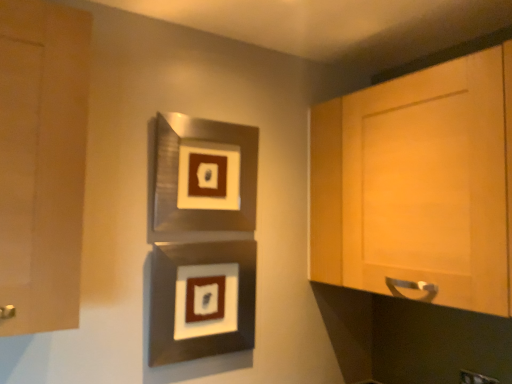
How much space does metallic silver picture frame at center, positioned as the 2th picture frame in top-to-bottom order, occupy vertically?

The height of metallic silver picture frame at center, positioned as the 2th picture frame in top-to-bottom order, is 14.76 inches.

Locate an element on the screen. The height and width of the screenshot is (384, 512). matte wood cabinet at left, the second cabinetry positioned from the right is located at coordinates (42, 162).

You are a GUI agent. You are given a task and a screenshot of the screen. Output one action in this format:
    pyautogui.click(x=<x>, y=<y>)
    Task: Click on the metallic silver picture frame at center, which ranks as the second picture frame in bottom-to-top order
    Image resolution: width=512 pixels, height=384 pixels.
    Given the screenshot: What is the action you would take?
    pyautogui.click(x=204, y=175)

The image size is (512, 384). I want to click on metallic silver picture frame at center, the first picture frame positioned from the bottom, so click(x=202, y=300).

Measure the distance between matte wood cabinet at left, the second cabinetry positioned from the right, and light wood cabinet at right, the 1th cabinetry in the right-to-left sequence.

matte wood cabinet at left, the second cabinetry positioned from the right, and light wood cabinet at right, the 1th cabinetry in the right-to-left sequence, are 39.02 inches apart.

Are matte wood cabinet at left, the second cabinetry positioned from the right, and light wood cabinet at right, which ranks as the second cabinetry in left-to-right order, far apart?

matte wood cabinet at left, the second cabinetry positioned from the right, is actually quite close to light wood cabinet at right, which ranks as the second cabinetry in left-to-right order.

Which of these two, matte wood cabinet at left, the second cabinetry positioned from the right, or light wood cabinet at right, which ranks as the second cabinetry in left-to-right order, is wider?

light wood cabinet at right, which ranks as the second cabinetry in left-to-right order.

Locate an element on the screen. cabinetry that is on the left side of light wood cabinet at right, the 1th cabinetry in the right-to-left sequence is located at coordinates (42, 162).

Measure the distance from matte wood cabinet at left, which is the 1th cabinetry from left to right, to metallic silver picture frame at center, the first picture frame positioned from the bottom.

matte wood cabinet at left, which is the 1th cabinetry from left to right, is 23.36 inches away from metallic silver picture frame at center, the first picture frame positioned from the bottom.

Which object is wider, matte wood cabinet at left, the second cabinetry positioned from the right, or metallic silver picture frame at center, positioned as the 2th picture frame in top-to-bottom order?

With larger width is matte wood cabinet at left, the second cabinetry positioned from the right.

Does matte wood cabinet at left, the second cabinetry positioned from the right, contain metallic silver picture frame at center, positioned as the 2th picture frame in top-to-bottom order?

No, metallic silver picture frame at center, positioned as the 2th picture frame in top-to-bottom order, is located outside of matte wood cabinet at left, the second cabinetry positioned from the right.

Could you tell me if matte wood cabinet at left, the second cabinetry positioned from the right, is facing metallic silver picture frame at center, the first picture frame positioned from the bottom?

No.

From a real-world perspective, between metallic silver picture frame at center, which ranks as the second picture frame in bottom-to-top order, and light wood cabinet at right, which ranks as the second cabinetry in left-to-right order, who is vertically lower?

light wood cabinet at right, which ranks as the second cabinetry in left-to-right order, is physically lower.

Locate an element on the screen. This screenshot has height=384, width=512. cabinetry on the right of the metallic silver picture frame at center, which ranks as the second picture frame in bottom-to-top order is located at coordinates (417, 184).

Is metallic silver picture frame at center, which ranks as the first picture frame in top-to-bottom order, shorter than light wood cabinet at right, which ranks as the second cabinetry in left-to-right order?

Yes.

Based on the photo, considering the relative positions of metallic silver picture frame at center, which ranks as the first picture frame in top-to-bottom order, and light wood cabinet at right, the 1th cabinetry in the right-to-left sequence, in the image provided, is metallic silver picture frame at center, which ranks as the first picture frame in top-to-bottom order, to the right of light wood cabinet at right, the 1th cabinetry in the right-to-left sequence, from the viewer's perspective?

No, metallic silver picture frame at center, which ranks as the first picture frame in top-to-bottom order, is not to the right of light wood cabinet at right, the 1th cabinetry in the right-to-left sequence.

How far apart are metallic silver picture frame at center, positioned as the 2th picture frame in top-to-bottom order, and light wood cabinet at right, which ranks as the second cabinetry in left-to-right order?

The distance of metallic silver picture frame at center, positioned as the 2th picture frame in top-to-bottom order, from light wood cabinet at right, which ranks as the second cabinetry in left-to-right order, is 21.63 inches.

Would you say metallic silver picture frame at center, positioned as the 2th picture frame in top-to-bottom order, contains light wood cabinet at right, which ranks as the second cabinetry in left-to-right order?

Definitely not — light wood cabinet at right, which ranks as the second cabinetry in left-to-right order, is not inside metallic silver picture frame at center, positioned as the 2th picture frame in top-to-bottom order.

Where is `picture frame below the light wood cabinet at right, the 1th cabinetry in the right-to-left sequence (from a real-world perspective)`? picture frame below the light wood cabinet at right, the 1th cabinetry in the right-to-left sequence (from a real-world perspective) is located at coordinates (202, 300).

Consider the image. Is metallic silver picture frame at center, positioned as the 2th picture frame in top-to-bottom order, oriented towards light wood cabinet at right, the 1th cabinetry in the right-to-left sequence?

No, metallic silver picture frame at center, positioned as the 2th picture frame in top-to-bottom order, is not facing towards light wood cabinet at right, the 1th cabinetry in the right-to-left sequence.

Looking at this image, does light wood cabinet at right, the 1th cabinetry in the right-to-left sequence, have a greater width compared to metallic silver picture frame at center, the first picture frame positioned from the bottom?

Yes.

Could you tell me if light wood cabinet at right, the 1th cabinetry in the right-to-left sequence, is facing metallic silver picture frame at center, positioned as the 2th picture frame in top-to-bottom order?

Yes, light wood cabinet at right, the 1th cabinetry in the right-to-left sequence, is oriented towards metallic silver picture frame at center, positioned as the 2th picture frame in top-to-bottom order.

Is metallic silver picture frame at center, the first picture frame positioned from the bottom, completely or partially inside light wood cabinet at right, the 1th cabinetry in the right-to-left sequence?

Actually, metallic silver picture frame at center, the first picture frame positioned from the bottom, is outside light wood cabinet at right, the 1th cabinetry in the right-to-left sequence.

From a real-world perspective, which object stands above the other?

light wood cabinet at right, the 1th cabinetry in the right-to-left sequence, from a real-world perspective.

Can you see light wood cabinet at right, which ranks as the second cabinetry in left-to-right order, touching matte wood cabinet at left, which is the 1th cabinetry from left to right?

No.

Between light wood cabinet at right, which ranks as the second cabinetry in left-to-right order, and matte wood cabinet at left, the second cabinetry positioned from the right, which one appears on the right side from the viewer's perspective?

light wood cabinet at right, which ranks as the second cabinetry in left-to-right order, is more to the right.

From the image's perspective, relative to matte wood cabinet at left, which is the 1th cabinetry from left to right, is light wood cabinet at right, which ranks as the second cabinetry in left-to-right order, above or below?

Based on their image positions, light wood cabinet at right, which ranks as the second cabinetry in left-to-right order, is located beneath matte wood cabinet at left, which is the 1th cabinetry from left to right.

Is light wood cabinet at right, the 1th cabinetry in the right-to-left sequence, completely or partially outside of matte wood cabinet at left, the second cabinetry positioned from the right?

Yes, light wood cabinet at right, the 1th cabinetry in the right-to-left sequence, is not within matte wood cabinet at left, the second cabinetry positioned from the right.

Is metallic silver picture frame at center, positioned as the 2th picture frame in top-to-bottom order, next to matte wood cabinet at left, the second cabinetry positioned from the right?

No, metallic silver picture frame at center, positioned as the 2th picture frame in top-to-bottom order, is not touching matte wood cabinet at left, the second cabinetry positioned from the right.

Choose the correct answer: Is metallic silver picture frame at center, the first picture frame positioned from the bottom, inside matte wood cabinet at left, the second cabinetry positioned from the right, or outside it?

metallic silver picture frame at center, the first picture frame positioned from the bottom, is spatially situated outside matte wood cabinet at left, the second cabinetry positioned from the right.

From a real-world perspective, is metallic silver picture frame at center, positioned as the 2th picture frame in top-to-bottom order, located beneath matte wood cabinet at left, the second cabinetry positioned from the right?

Yes, from a real-world perspective, metallic silver picture frame at center, positioned as the 2th picture frame in top-to-bottom order, is below matte wood cabinet at left, the second cabinetry positioned from the right.

In the scene shown: How much distance is there between metallic silver picture frame at center, the first picture frame positioned from the bottom, and matte wood cabinet at left, the second cabinetry positioned from the right?

metallic silver picture frame at center, the first picture frame positioned from the bottom, and matte wood cabinet at left, the second cabinetry positioned from the right, are 59.34 centimeters apart from each other.

This screenshot has height=384, width=512. Find the location of `cabinetry that is above the light wood cabinet at right, which ranks as the second cabinetry in left-to-right order (from the image's perspective)`. cabinetry that is above the light wood cabinet at right, which ranks as the second cabinetry in left-to-right order (from the image's perspective) is located at coordinates (42, 162).

The image size is (512, 384). Identify the location of picture frame below the matte wood cabinet at left, the second cabinetry positioned from the right (from a real-world perspective). (202, 300).

Which object lies further to the anchor point light wood cabinet at right, which ranks as the second cabinetry in left-to-right order, matte wood cabinet at left, the second cabinetry positioned from the right, or metallic silver picture frame at center, positioned as the 2th picture frame in top-to-bottom order?

Among the two, matte wood cabinet at left, the second cabinetry positioned from the right, is located further to light wood cabinet at right, which ranks as the second cabinetry in left-to-right order.

Based on their spatial positions, is matte wood cabinet at left, the second cabinetry positioned from the right, or light wood cabinet at right, the 1th cabinetry in the right-to-left sequence, further from metallic silver picture frame at center, the first picture frame positioned from the bottom?

matte wood cabinet at left, the second cabinetry positioned from the right.

Which object lies nearer to the anchor point metallic silver picture frame at center, which ranks as the first picture frame in top-to-bottom order, metallic silver picture frame at center, positioned as the 2th picture frame in top-to-bottom order, or light wood cabinet at right, which ranks as the second cabinetry in left-to-right order?

Based on the image, metallic silver picture frame at center, positioned as the 2th picture frame in top-to-bottom order, appears to be nearer to metallic silver picture frame at center, which ranks as the first picture frame in top-to-bottom order.

Estimate the real-world distances between objects in this image. Which object is closer to metallic silver picture frame at center, the first picture frame positioned from the bottom, light wood cabinet at right, which ranks as the second cabinetry in left-to-right order, or metallic silver picture frame at center, which ranks as the second picture frame in bottom-to-top order?

Based on the image, metallic silver picture frame at center, which ranks as the second picture frame in bottom-to-top order, appears to be nearer to metallic silver picture frame at center, the first picture frame positioned from the bottom.

Considering their positions, is light wood cabinet at right, which ranks as the second cabinetry in left-to-right order, positioned closer to metallic silver picture frame at center, which ranks as the first picture frame in top-to-bottom order, than metallic silver picture frame at center, positioned as the 2th picture frame in top-to-bottom order?

metallic silver picture frame at center, positioned as the 2th picture frame in top-to-bottom order.

Considering their positions, is metallic silver picture frame at center, the first picture frame positioned from the bottom, positioned further to matte wood cabinet at left, which is the 1th cabinetry from left to right, than light wood cabinet at right, the 1th cabinetry in the right-to-left sequence?

light wood cabinet at right, the 1th cabinetry in the right-to-left sequence, is further to matte wood cabinet at left, which is the 1th cabinetry from left to right.

Based on their spatial positions, is metallic silver picture frame at center, which ranks as the second picture frame in bottom-to-top order, or metallic silver picture frame at center, the first picture frame positioned from the bottom, further from light wood cabinet at right, which ranks as the second cabinetry in left-to-right order?

metallic silver picture frame at center, the first picture frame positioned from the bottom, is further to light wood cabinet at right, which ranks as the second cabinetry in left-to-right order.

Based on their spatial positions, is metallic silver picture frame at center, which ranks as the first picture frame in top-to-bottom order, or metallic silver picture frame at center, the first picture frame positioned from the bottom, closer to matte wood cabinet at left, which is the 1th cabinetry from left to right?

metallic silver picture frame at center, which ranks as the first picture frame in top-to-bottom order, is closer to matte wood cabinet at left, which is the 1th cabinetry from left to right.

You are a GUI agent. You are given a task and a screenshot of the screen. Output one action in this format:
    pyautogui.click(x=<x>, y=<y>)
    Task: Click on the picture frame between metallic silver picture frame at center, the first picture frame positioned from the bottom, and light wood cabinet at right, the 1th cabinetry in the right-to-left sequence, in the horizontal direction
    This screenshot has width=512, height=384.
    Given the screenshot: What is the action you would take?
    pyautogui.click(x=204, y=175)

Locate an element on the screen. This screenshot has height=384, width=512. picture frame positioned between matte wood cabinet at left, the second cabinetry positioned from the right, and metallic silver picture frame at center, which ranks as the second picture frame in bottom-to-top order, from near to far is located at coordinates (202, 300).